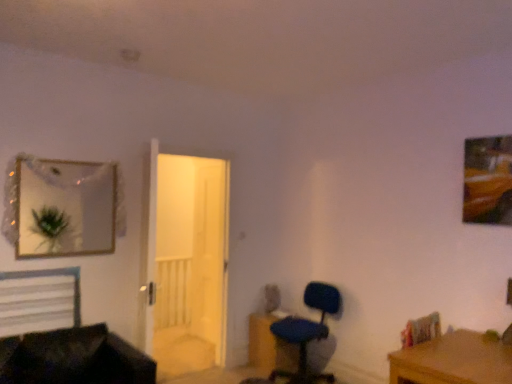
The image size is (512, 384). Find the location of `brown wooden desk at lower right`. brown wooden desk at lower right is located at coordinates (453, 361).

Locate an element on the screen. wooden frame at upper right is located at coordinates (488, 180).

This screenshot has height=384, width=512. What do you see at coordinates (185, 261) in the screenshot? I see `white wooden door at center` at bounding box center [185, 261].

At what (x,y) coordinates should I click in order to perform the action: click on blue fabric chair at lower right. Please return your answer as a coordinate pair (x, y). Looking at the image, I should click on (307, 331).

Describe the element at coordinates (307, 331) in the screenshot. I see `blue fabric chair at lower right` at that location.

This screenshot has height=384, width=512. What do you see at coordinates (74, 358) in the screenshot? I see `black leather couch at lower left` at bounding box center [74, 358].

Find the location of a particular element. Image resolution: width=512 pixels, height=384 pixels. white matte bed at lower left is located at coordinates pos(38,298).

Is matte silver mirror at upper left bigger than white wooden door at center?

Actually, matte silver mirror at upper left might be smaller than white wooden door at center.

Is matte silver mirror at upper left directly adjacent to white wooden door at center?

No, matte silver mirror at upper left is not touching white wooden door at center.

Would you say matte silver mirror at upper left is inside or outside white wooden door at center?

matte silver mirror at upper left is located beyond the bounds of white wooden door at center.

This screenshot has height=384, width=512. I want to click on mirror above the white wooden door at center (from the image's perspective), so click(x=66, y=214).

Which point is more forward, (142, 355) or (62, 312)?

The point (62, 312) is more forward.

Does black leather couch at lower left turn towards white matte bed at lower left?

No, black leather couch at lower left is not aimed at white matte bed at lower left.

Is black leather couch at lower left next to white matte bed at lower left?

No.

Find the location of a particular element. This screenshot has height=384, width=512. couch located underneath the white matte bed at lower left (from a real-world perspective) is located at coordinates (74, 358).

Is wooden frame at upper right inside the boundaries of brown wooden desk at lower right, or outside?

The correct answer is: outside.

In the scene shown: Considering the positions of objects wooden frame at upper right and brown wooden desk at lower right in the image provided, who is more to the right, wooden frame at upper right or brown wooden desk at lower right?

From the viewer's perspective, wooden frame at upper right appears more on the right side.

In the scene shown: Which point is more forward, (489, 158) or (501, 362)?

The point (501, 362) is in front.

Identify the location of picture frame behind the brown wooden desk at lower right. This screenshot has height=384, width=512. (488, 180).

Which of these two, white matte bed at lower left or white wooden door at center, stands shorter?

white matte bed at lower left.

What's the angular difference between white matte bed at lower left and white wooden door at center's facing directions?

0.571 degrees.

Can you confirm if white matte bed at lower left is thinner than white wooden door at center?

No, white matte bed at lower left is not thinner than white wooden door at center.

Would you say white wooden door at center is part of white matte bed at lower left's contents?

No.

Would you say brown wooden desk at lower right is a long distance from wooden frame at upper right?

Yes, brown wooden desk at lower right and wooden frame at upper right are quite far apart.

Looking at this image, which object is positioned more to the right, brown wooden desk at lower right or wooden frame at upper right?

wooden frame at upper right.

Between brown wooden desk at lower right and wooden frame at upper right, which one is positioned behind?

wooden frame at upper right is behind.

Could you tell me if brown wooden desk at lower right is turned towards wooden frame at upper right?

No, brown wooden desk at lower right is not oriented towards wooden frame at upper right.

How distant is wooden frame at upper right from black leather couch at lower left?

A distance of 8.90 feet exists between wooden frame at upper right and black leather couch at lower left.

Visually, is wooden frame at upper right positioned to the left or to the right of black leather couch at lower left?

Clearly, wooden frame at upper right is on the right of black leather couch at lower left in the image.

Is black leather couch at lower left at the back of wooden frame at upper right?

No, wooden frame at upper right is not facing away from black leather couch at lower left.

From a real-world perspective, between wooden frame at upper right and black leather couch at lower left, who is vertically lower?

black leather couch at lower left is physically lower.

From the picture: Is wooden frame at upper right far from white wooden door at center?

wooden frame at upper right is far away from white wooden door at center.

This screenshot has width=512, height=384. There is a white wooden door at center. Identify the location of picture frame above it (from a real-world perspective). (488, 180).

Considering the relative positions of wooden frame at upper right and white wooden door at center in the image provided, is wooden frame at upper right to the left of white wooden door at center from the viewer's perspective?

No.

What are the coordinates of `door on the right of matte silver mirror at upper left` in the screenshot? It's located at (185, 261).

Find the location of a particular element. The image size is (512, 384). couch in front of the white matte bed at lower left is located at coordinates (74, 358).

Based on their spatial positions, is white matte bed at lower left or matte silver mirror at upper left closer to black leather couch at lower left?

white matte bed at lower left lies closer to black leather couch at lower left than the other object.

When comparing their distances from brown wooden desk at lower right, does black leather couch at lower left or white wooden door at center seem further?

white wooden door at center is positioned further to the anchor brown wooden desk at lower right.

When comparing their distances from matte silver mirror at upper left, does white matte bed at lower left or white wooden door at center seem further?

white wooden door at center.

When comparing their distances from matte silver mirror at upper left, does blue fabric chair at lower right or wooden frame at upper right seem closer?

The object closer to matte silver mirror at upper left is blue fabric chair at lower right.

When comparing their distances from blue fabric chair at lower right, does brown wooden desk at lower right or white matte bed at lower left seem closer?

brown wooden desk at lower right lies closer to blue fabric chair at lower right than the other object.

Looking at the image, which one is located closer to black leather couch at lower left, brown wooden desk at lower right or wooden frame at upper right?

Among the two, brown wooden desk at lower right is located nearer to black leather couch at lower left.

Considering their positions, is wooden frame at upper right positioned closer to black leather couch at lower left than white matte bed at lower left?

The object closer to black leather couch at lower left is white matte bed at lower left.

Considering their positions, is white wooden door at center positioned further to wooden frame at upper right than matte silver mirror at upper left?

Among the two, matte silver mirror at upper left is located further to wooden frame at upper right.

I want to click on bed between black leather couch at lower left and white wooden door at center from front to back, so click(x=38, y=298).

Locate an element on the screen. The height and width of the screenshot is (384, 512). desk between wooden frame at upper right and blue fabric chair at lower right from top to bottom is located at coordinates (453, 361).

At what (x,y) coordinates should I click in order to perform the action: click on mirror between white matte bed at lower left and blue fabric chair at lower right in the horizontal direction. Please return your answer as a coordinate pair (x, y). Image resolution: width=512 pixels, height=384 pixels. Looking at the image, I should click on (66, 214).

You are a GUI agent. You are given a task and a screenshot of the screen. Output one action in this format:
    pyautogui.click(x=<x>, y=<y>)
    Task: Click on the desk located between black leather couch at lower left and wooden frame at upper right in the left-right direction
    The image size is (512, 384).
    Given the screenshot: What is the action you would take?
    pyautogui.click(x=453, y=361)